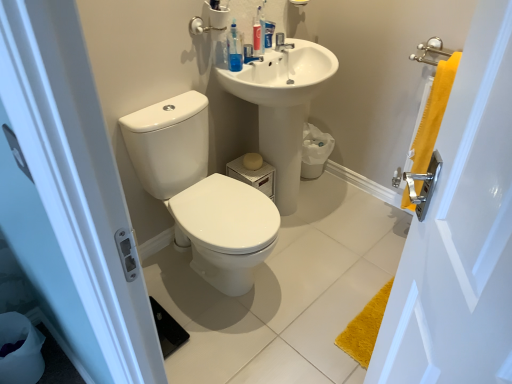
Question: Is translucent plastic toothpaste tube at upper center inside or outside of satin nickel faucet at upper center?

Choices:
 (A) outside
 (B) inside

Answer: (A)

Question: Considering the positions of translucent plastic toothpaste tube at upper center and satin nickel faucet at upper center in the image, is translucent plastic toothpaste tube at upper center taller or shorter than satin nickel faucet at upper center?

Choices:
 (A) tall
 (B) short

Answer: (A)

Question: Based on their relative distances, which object is nearer to the white glossy toilet at center?

Choices:
 (A) yellow fabric towel at right
 (B) white glossy sink at upper center
 (C) translucent plastic toothpaste tube at upper center
 (D) satin nickel faucet at upper center
 (E) translucent plastic mouthwash at upper center, which is the 2th mouthwash in back-to-front order

Answer: (B)

Question: Estimate the real-world distances between objects in this image. Which object is farther from the blue translucent mouthwash at upper center, which ranks as the 1th mouthwash in right-to-left order?

Choices:
 (A) translucent plastic mouthwash at upper center, which ranks as the 1th mouthwash in left-to-right order
 (B) translucent plastic toothpaste tube at upper center
 (C) white glossy sink at upper center
 (D) yellow fabric towel at right
 (E) yellow fabric towel at right

Answer: (E)